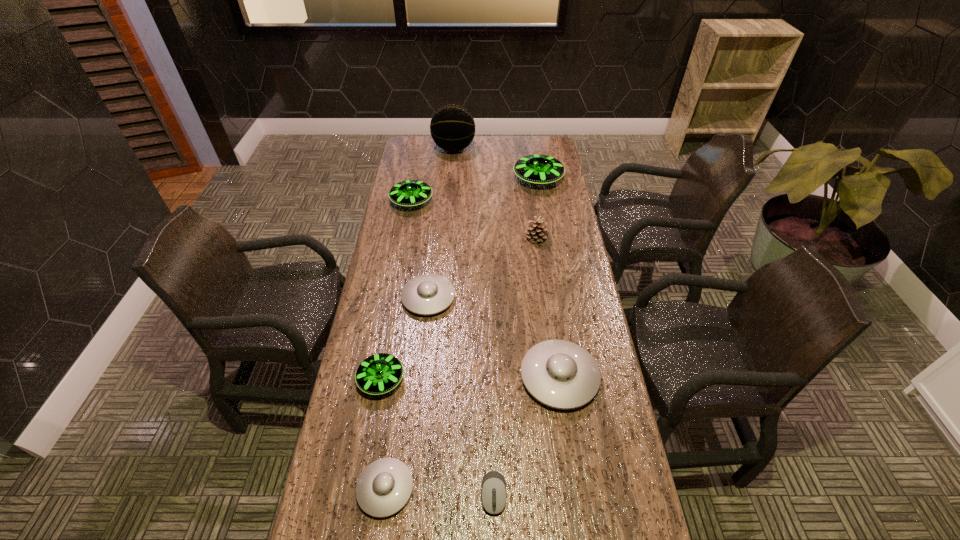
Where is `vacant space that satisfies the following two spatial constraints: 1. on the front side of the nearest saucer; 2. on the left side of the smallest green saucer`? The width and height of the screenshot is (960, 540). vacant space that satisfies the following two spatial constraints: 1. on the front side of the nearest saucer; 2. on the left side of the smallest green saucer is located at coordinates (362, 489).